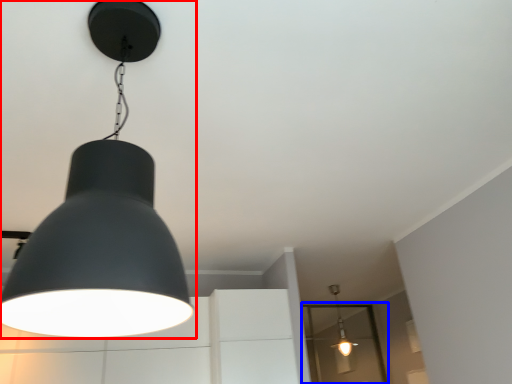
Question: Which of the following is the closest to the observer, lamp (highlighted by a red box) or glass door (highlighted by a blue box)?

Choices:
 (A) lamp
 (B) glass door

Answer: (A)